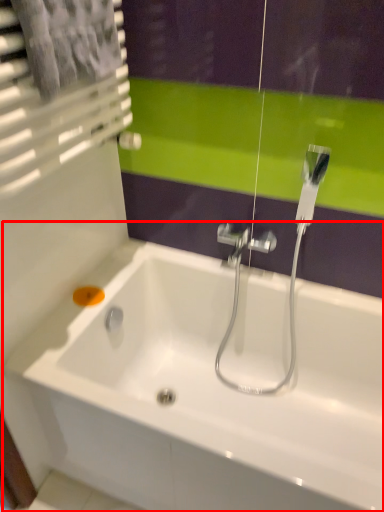
Question: From the image's perspective, considering the relative positions of bathtub (annotated by the red box) and soap in the image provided, where is bathtub (annotated by the red box) located with respect to the staircase?

Choices:
 (A) below
 (B) above

Answer: (A)